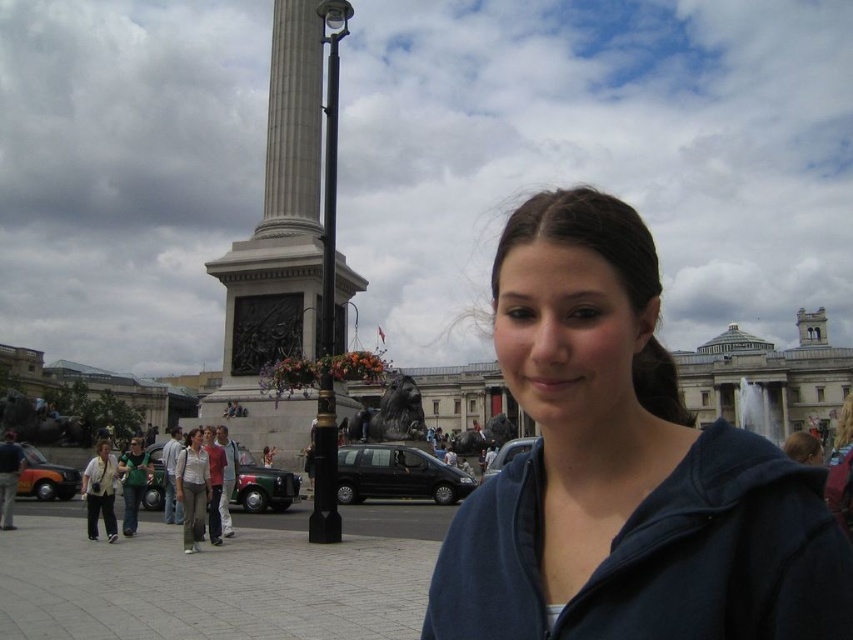
Question: Which object appears farthest from the camera in this image?

Choices:
 (A) light brown pants at lower left
 (B) blue fleece jacket at center

Answer: (A)

Question: Can you confirm if blue fleece jacket at center is thinner than light brown pants at lower left?

Choices:
 (A) no
 (B) yes

Answer: (A)

Question: Is blue fleece jacket at center to the right of light brown pants at lower left from the viewer's perspective?

Choices:
 (A) yes
 (B) no

Answer: (A)

Question: Does blue fleece jacket at center appear over light brown pants at lower left?

Choices:
 (A) yes
 (B) no

Answer: (A)

Question: Which of the following is the farthest from the observer?

Choices:
 (A) blue fleece jacket at center
 (B) light brown pants at lower left

Answer: (B)